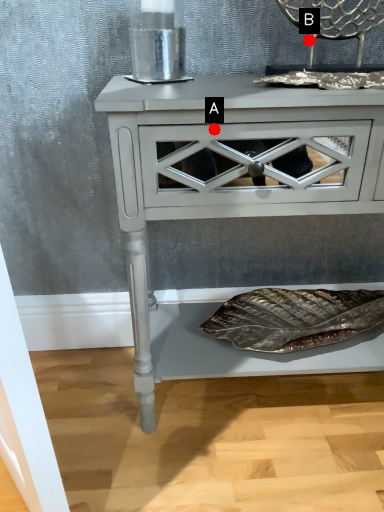
Question: Two points are circled on the image, labeled by A and B beside each circle. Which of the following is the closest to the observer?

Choices:
 (A) A is closer
 (B) B is closer

Answer: (A)